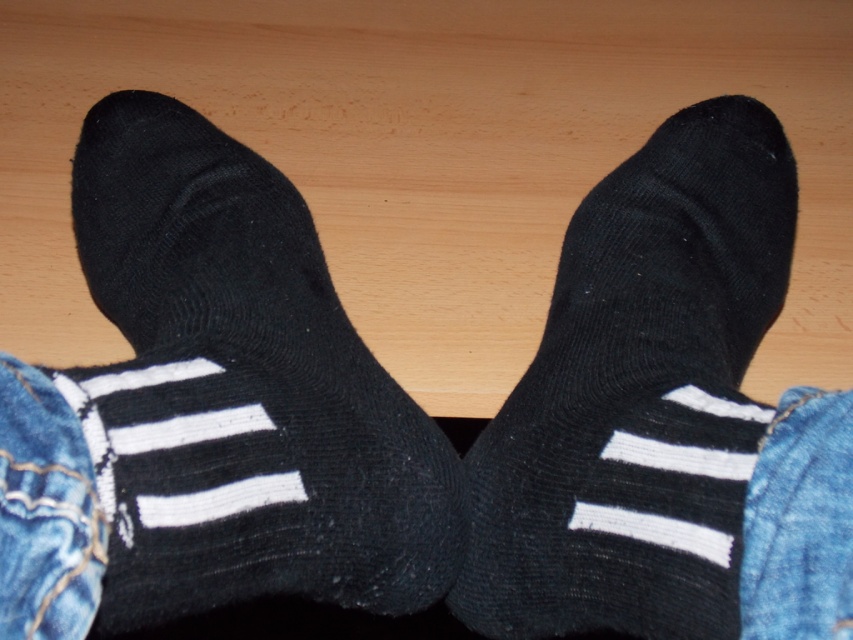
Question: Is the position of denim at lower right less distant than that of jeans at lower left?

Choices:
 (A) no
 (B) yes

Answer: (A)

Question: Which object is closer to the camera taking this photo?

Choices:
 (A) jeans at lower left
 (B) denim at lower right
 (C) black ribbed sock at center

Answer: (A)

Question: Does black ribbed sock at center appear over jeans at lower left?

Choices:
 (A) yes
 (B) no

Answer: (A)

Question: Which of these objects is positioned closest to the denim at lower right?

Choices:
 (A) jeans at lower left
 (B) black ribbed sock at center

Answer: (B)

Question: Which point appears closest to the camera in this image?

Choices:
 (A) click(486, 592)
 (B) click(798, 481)
 (C) click(9, 413)
 (D) click(421, 426)

Answer: (C)

Question: Does black ribbed sock at center have a smaller size compared to denim at lower right?

Choices:
 (A) no
 (B) yes

Answer: (A)